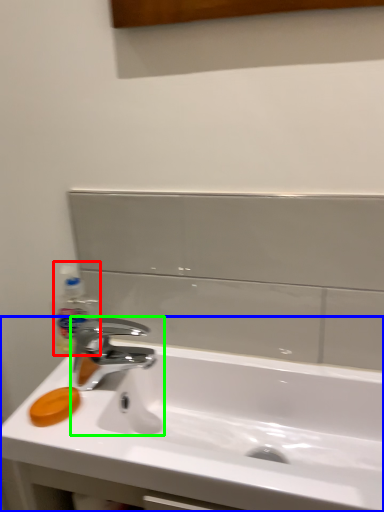
Question: Which object is positioned farthest from bottle (highlighted by a red box)? Select from sink (highlighted by a blue box) and tap (highlighted by a green box).

Choices:
 (A) sink
 (B) tap

Answer: (A)